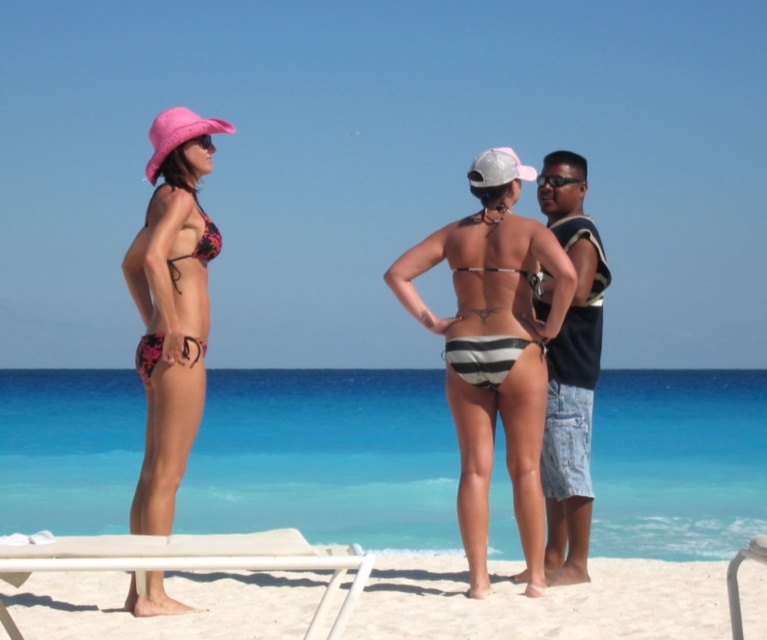
Question: Can you confirm if striped bikini bottom at center is positioned to the right of floral bikini at left?

Choices:
 (A) no
 (B) yes

Answer: (B)

Question: Which object is positioned farthest from the white plastic beach chair at lower right?

Choices:
 (A) white plastic beach chair at lower left
 (B) black plastic goggles at upper center
 (C) floral print bikini top at left
 (D) floral print bikini at left

Answer: (C)

Question: Which object is positioned farthest from the floral print bikini top at left?

Choices:
 (A) black plastic goggles at upper center
 (B) white plastic beach chair at lower right
 (C) white sand at lower center
 (D) floral print bikini at left

Answer: (B)

Question: Observing the image, what is the correct spatial positioning of white sand at lower center in reference to floral print bikini top at left?

Choices:
 (A) left
 (B) right

Answer: (B)

Question: Which point is farther to the camera?

Choices:
 (A) (203, 376)
 (B) (764, 534)
 (C) (287, 552)

Answer: (A)

Question: Is floral print bikini at left positioned behind floral print bikini top at left?

Choices:
 (A) no
 (B) yes

Answer: (A)